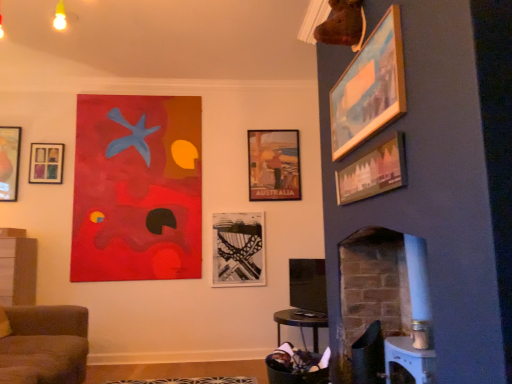
Question: Considering the relative positions of matte black picture frame at upper left, positioned as the 3th picture frame in front-to-back order, and brown fabric couch at lower left in the image provided, is matte black picture frame at upper left, positioned as the 3th picture frame in front-to-back order, to the left or to the right of brown fabric couch at lower left?

Choices:
 (A) right
 (B) left

Answer: (B)

Question: From a real-world perspective, is matte black picture frame at upper left, positioned as the 3th picture frame in front-to-back order, positioned above or below brown fabric couch at lower left?

Choices:
 (A) above
 (B) below

Answer: (A)

Question: Which is nearer to the white painted brick fireplace at right?

Choices:
 (A) matte wooden picture frame at upper right, positioned as the 2th picture frame in right-to-left order
 (B) metallic silver swivel chair at lower right
 (C) wooden picture frame at upper right, placed as the 6th picture frame when sorted from left to right
 (D) black textured roller coaster at center, which appears as the 4th picture frame when viewed from the right
 (E) matte black picture frame at upper left, positioned as the 3th picture frame in front-to-back order

Answer: (B)

Question: Based on their relative distances, which object is nearer to the black textured roller coaster at center, the second picture frame in the back-to-front sequence?

Choices:
 (A) metallic silver swivel chair at lower right
 (B) matte paper poster at center, which appears as the sixth picture frame when viewed from the front
 (C) matte wooden picture frame at upper right, positioned as the 2th picture frame in right-to-left order
 (D) matte glass picture frame at upper left, the 4th picture frame positioned from the front
 (E) brown fabric couch at lower left

Answer: (B)